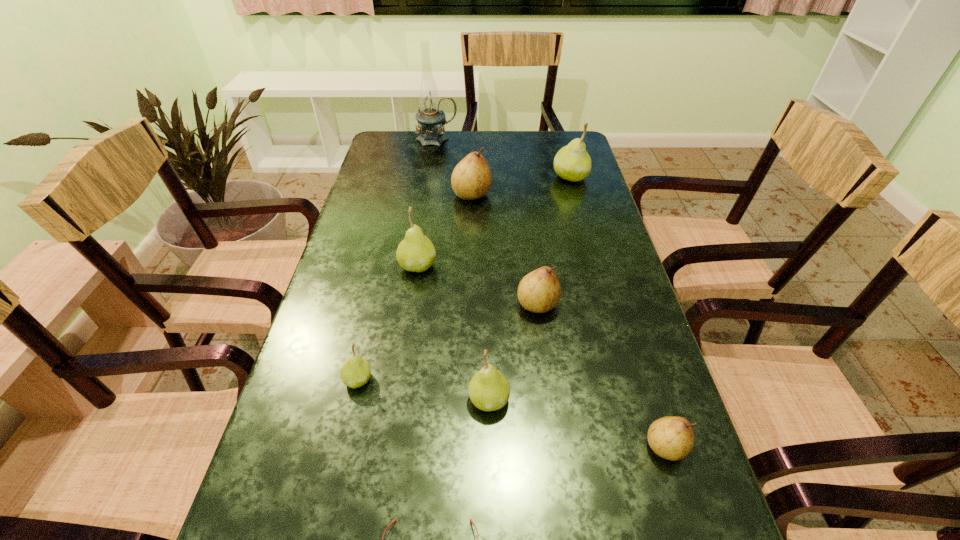
This screenshot has height=540, width=960. Find the location of `vacant point located between the second farthest brown pear and the nearest pear`. vacant point located between the second farthest brown pear and the nearest pear is located at coordinates (602, 376).

Where is `vacant point located between the third biggest green pear and the nearest pear`? Image resolution: width=960 pixels, height=540 pixels. vacant point located between the third biggest green pear and the nearest pear is located at coordinates (577, 423).

This screenshot has width=960, height=540. Identify the location of vacant point located between the fifth nearest pear and the second farthest brown pear. (478, 285).

Locate an element on the screen. Image resolution: width=960 pixels, height=540 pixels. free spot between the fifth nearest object and the second biggest green pear is located at coordinates (478, 285).

Find the location of a particular element. The width and height of the screenshot is (960, 540). object that is the fourth closest to the pink spectacles is located at coordinates (539, 291).

The height and width of the screenshot is (540, 960). Find the location of `object that ranks as the second closest to the fourth nearest pear`. object that ranks as the second closest to the fourth nearest pear is located at coordinates (416, 253).

Locate an element on the screen. The width and height of the screenshot is (960, 540). pear that is the closest to the tallest object is located at coordinates (471, 179).

Locate which pear ranks fourth in proximity to the biggest green pear. Please provide its 2D coordinates. Your answer should be formatted as a tuple, i.e. [(x, y)], where the tuple contains the x and y coordinates of a point satisfying the conditions above.

[(489, 390)]

Identify the location of green pear that is the fourth closest one to the biggest brown pear. (489, 390).

I want to click on the fourth closest green pear to the pink spectacles, so click(x=572, y=162).